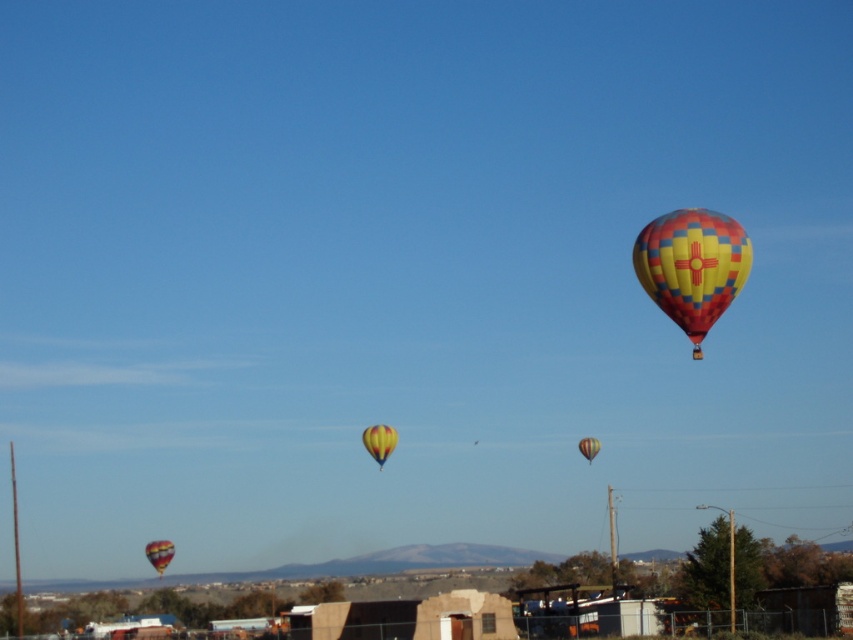
Question: Which point is farther from the camera taking this photo?

Choices:
 (A) (704, 308)
 (B) (598, 442)

Answer: (B)

Question: Is yellow matte balloon at center smaller than yellow checkered balloon at upper right?

Choices:
 (A) no
 (B) yes

Answer: (B)

Question: Can you confirm if checkered fabric hot air balloon at right is positioned to the right of matte yellow balloon at lower left?

Choices:
 (A) yes
 (B) no

Answer: (A)

Question: Which object appears closest to the camera in this image?

Choices:
 (A) checkered fabric hot air balloon at right
 (B) matte yellow balloon at lower left
 (C) yellow checkered balloon at upper right
 (D) yellow matte balloon at center

Answer: (A)

Question: Is the position of yellow matte balloon at center less distant than that of yellow checkered balloon at upper right?

Choices:
 (A) yes
 (B) no

Answer: (B)

Question: Which of these objects is positioned closest to the yellow matte balloon at center?

Choices:
 (A) matte yellow balloon at lower left
 (B) checkered fabric hot air balloon at right

Answer: (A)